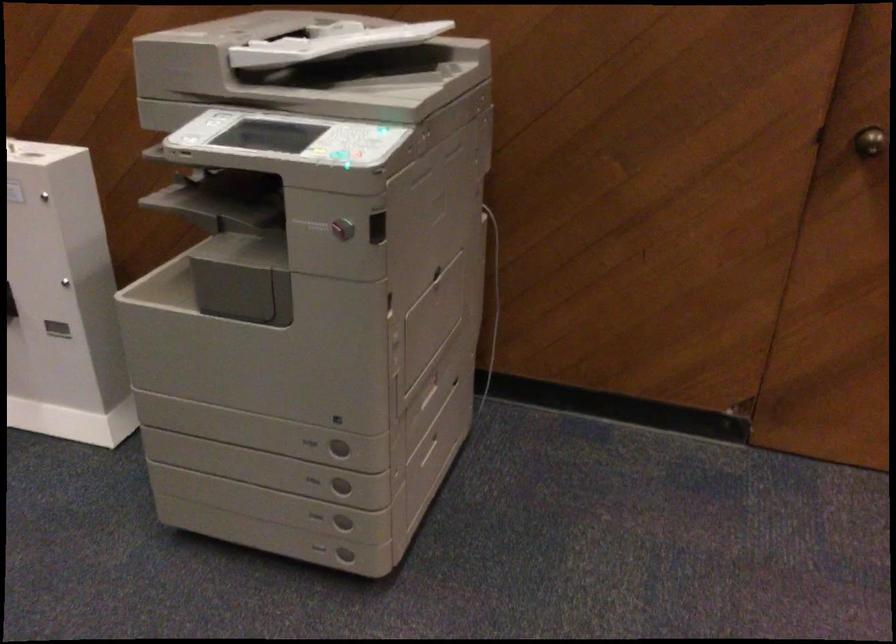
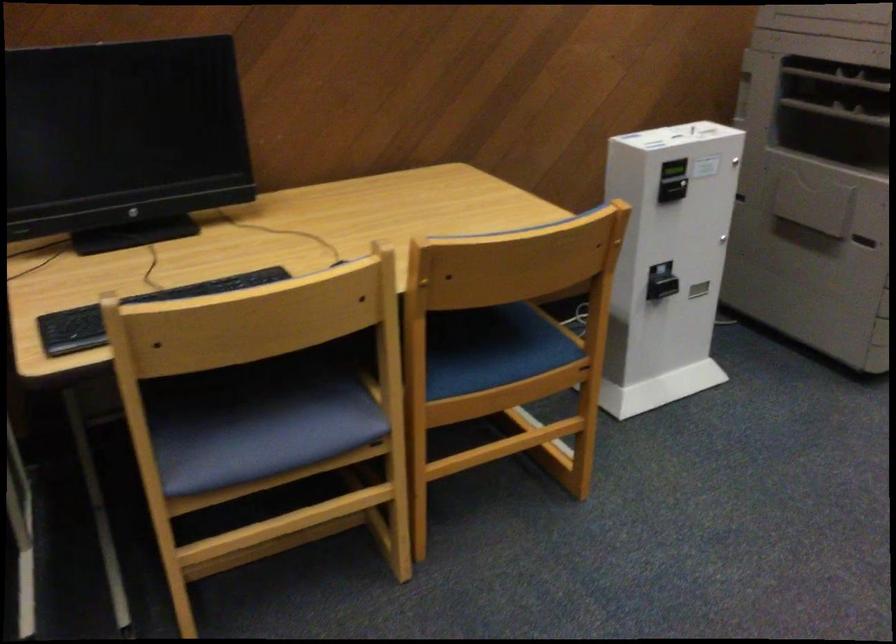
Where in the second image is the point corresponding to (192,190) from the first image?

(836, 111)